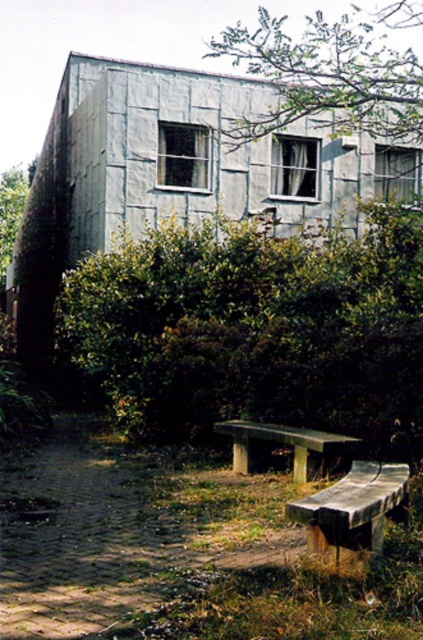
Who is higher up, green leafy hedge at center or green leafy tree at left?

Positioned higher is green leafy tree at left.

This screenshot has height=640, width=423. What do you see at coordinates (255, 326) in the screenshot?
I see `green leafy hedge at center` at bounding box center [255, 326].

Identify the location of green leafy hedge at center. (255, 326).

Measure the distance from metallic gray hut at center to smooth concrete bench at center.

The distance of metallic gray hut at center from smooth concrete bench at center is 36.60 feet.

Between metallic gray hut at center and smooth concrete bench at center, which one appears on the left side from the viewer's perspective?

metallic gray hut at center is more to the left.

Is point (52, 275) farther from viewer compared to point (235, 433)?

Yes, point (52, 275) is behind point (235, 433).

Locate an element on the screen. The height and width of the screenshot is (640, 423). metallic gray hut at center is located at coordinates coord(173,173).

Locate an element on the screen. green leafy hedge at center is located at coordinates (255, 326).

Who is shorter, green leafy hedge at center or metallic gray hut at center?

green leafy hedge at center is shorter.

The width and height of the screenshot is (423, 640). In order to click on green leafy hedge at center in this screenshot , I will do `click(255, 326)`.